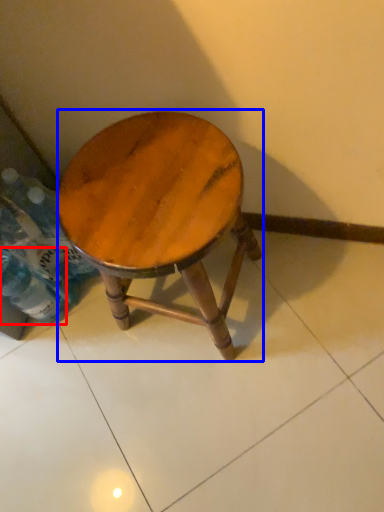
Question: Which point is closer to the camera, bottle (highlighted by a red box) or stool (highlighted by a blue box)?

Choices:
 (A) bottle
 (B) stool

Answer: (B)